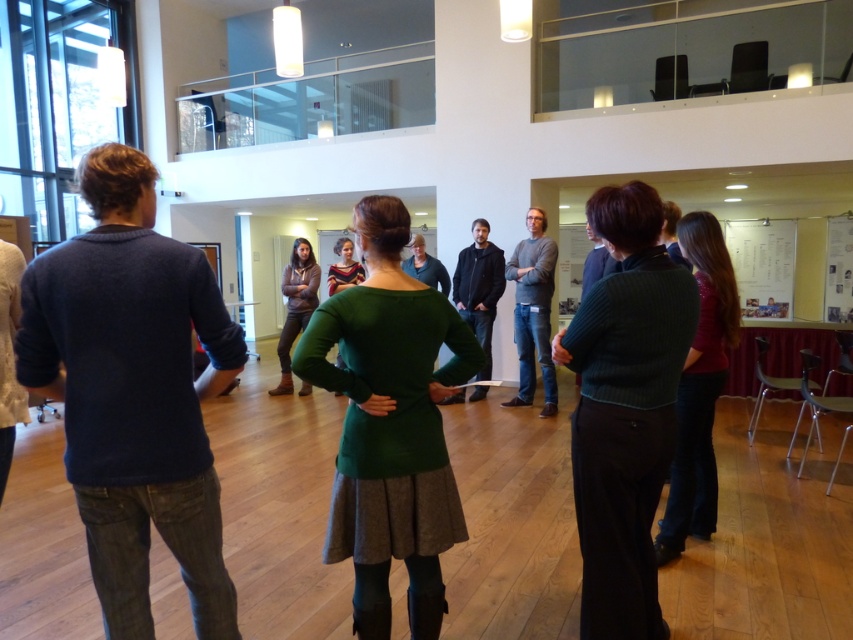
Question: Which object appears closest to the camera in this image?

Choices:
 (A) dark gray sweater at center
 (B) dark green sweater at center
 (C) gray sweater at center

Answer: (B)

Question: Which point is closer to the camera taking this photo?

Choices:
 (A) (529, 314)
 (B) (688, 285)
 (C) (450, 348)

Answer: (B)

Question: Is the position of dark green sweater at center more distant than that of dark gray sweater at center?

Choices:
 (A) no
 (B) yes

Answer: (A)

Question: Does green woolen sweater at center appear on the left side of gray sweater at center?

Choices:
 (A) yes
 (B) no

Answer: (A)

Question: Which object is closer to the camera taking this photo?

Choices:
 (A) gray sweater at center
 (B) green woolen sweater at center

Answer: (B)

Question: Is shiny red sweater at center to the left of gray sweater at center from the viewer's perspective?

Choices:
 (A) no
 (B) yes

Answer: (A)